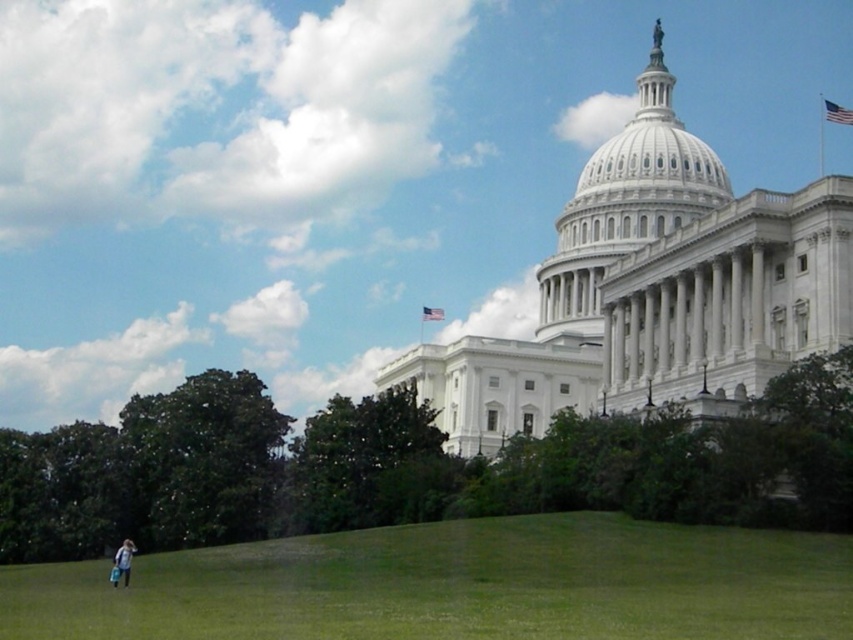
You are standing on the green grassy hill at lower left and want to place a small picnic basket on the light blue denim jacket at lower left. Can you do this without moving the jacket?

The green grassy hill at lower left is located above the light blue denim jacket at lower left, so placing the picnic basket would require moving the jacket to the ground first.

You are standing at the base of the green grassy hill at lower left and want to place a picnic blanket that is as wide as the light blue denim jacket at lower left. Will the hill be wide enough to accommodate the blanket?

The green grassy hill at lower left is wider than the light blue denim jacket at lower left, so yes, the hill is wide enough to accommodate the picnic blanket.